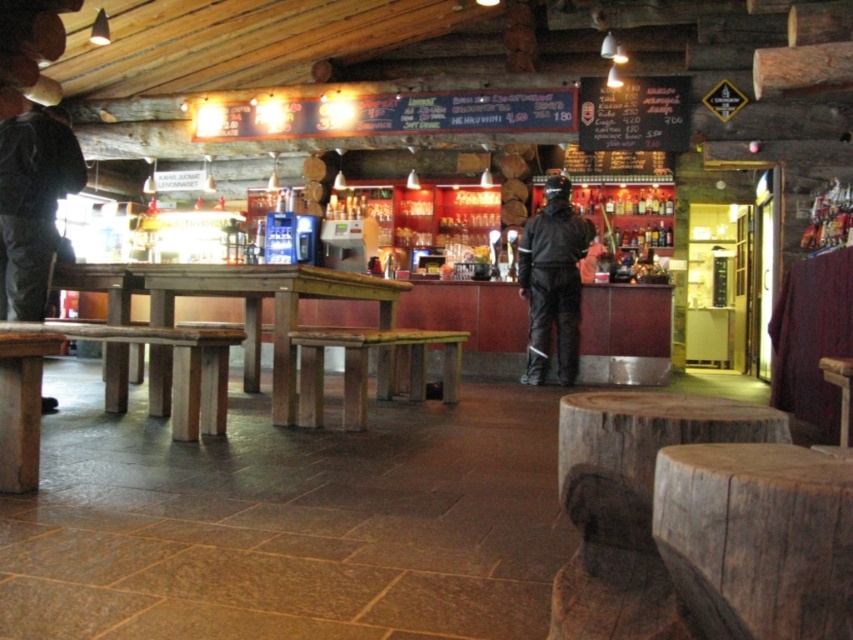
Is point (556, 294) behind point (328, 342)?

Yes, point (556, 294) is farther from viewer.

How much distance is there between black matte jacket at center and wooden bar stool at center?

A distance of 5.97 feet exists between black matte jacket at center and wooden bar stool at center.

Find the location of `black matte jacket at center`. black matte jacket at center is located at coordinates (552, 280).

Can you confirm if wooden table at center is positioned above wooden bar stool at center?

Correct, wooden table at center is located above wooden bar stool at center.

Which is behind, point (286, 400) or point (363, 426)?

Positioned behind is point (286, 400).

Locate an element on the screen. The height and width of the screenshot is (640, 853). wooden table at center is located at coordinates (260, 307).

Who is shorter, wooden table at center or black matte jacket at center?

wooden table at center is shorter.

In the scene shown: Does wooden table at center have a greater height compared to black matte jacket at center?

In fact, wooden table at center may be shorter than black matte jacket at center.

The height and width of the screenshot is (640, 853). What are the coordinates of `wooden table at center` in the screenshot? It's located at (260, 307).